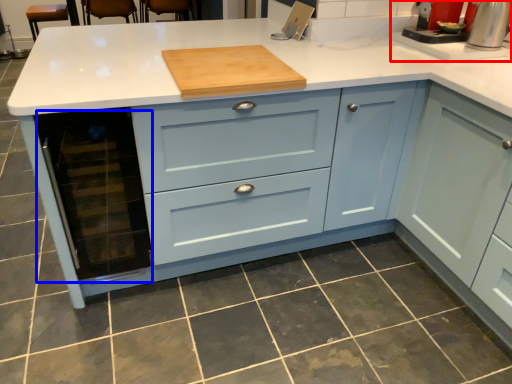
Question: Which object appears closest to the camera in this image, sink (highlighted by a red box) or appliance (highlighted by a blue box)?

Choices:
 (A) sink
 (B) appliance

Answer: (B)